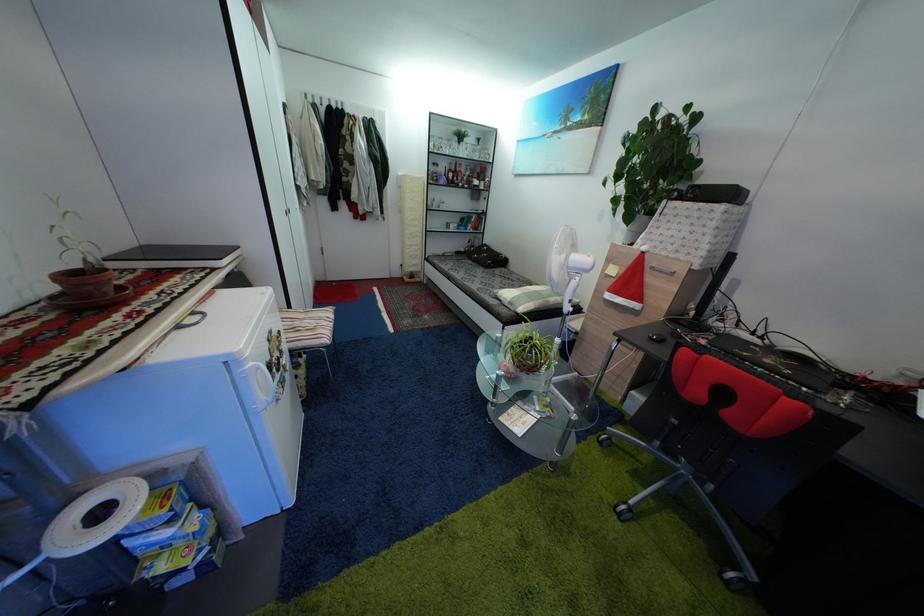
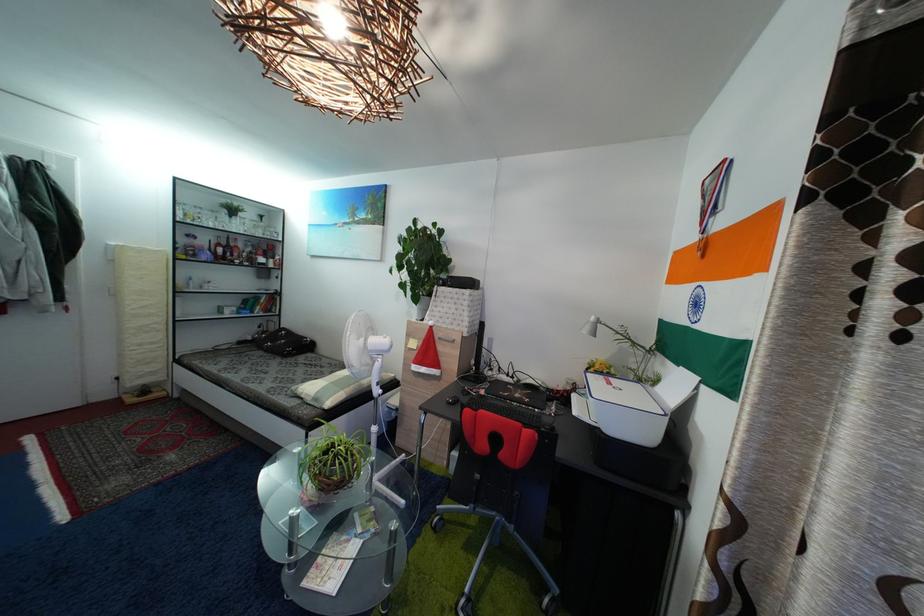
Locate, in the second image, the point that corresponds to pixel 589 265 in the first image.

(386, 349)